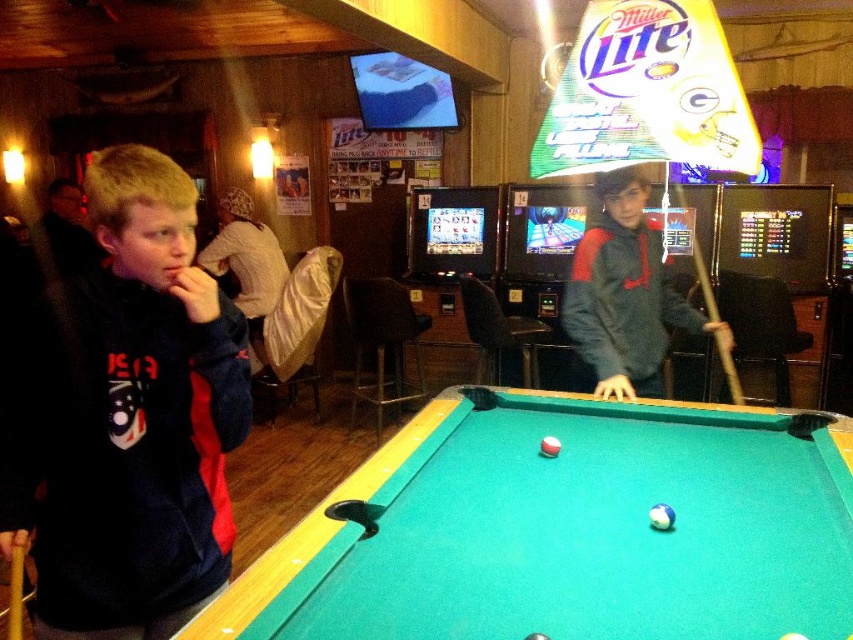
You are standing in the bar and want to take a photo of the two points marked in the image. Which point, point 1 at coordinates (x=469, y=516) or point 2 at coordinates (x=625, y=189), will appear larger in your photo?

Point 1 at coordinates (x=469, y=516) will appear larger in the photo because it is closer to the camera than point 2 at coordinates (x=625, y=189).

You are a customer in the bar and want to place your drink on the green felt pool table at center. However, there is a gray fleece hoodie at center on the table. Can you put your drink there without moving the hoodie?

The green felt pool table at center is below the gray fleece hoodie at center, meaning the hoodie is on top of the table. Since the hoodie is already occupying space on the table, you cannot place your drink there without moving the hoodie.

You are a customer in the bar and want to place a drink on the green felt pool table at center. However, the staff reminds you that the gray fleece hoodie at center is currently on the table. Can you put your drink there without moving the hoodie?

The green felt pool table at center is shorter than gray fleece hoodie at center, so the hoodie is likely placed on top of the table. Therefore, you can place your drink on the green felt pool table at center by moving the gray fleece hoodie at center aside.